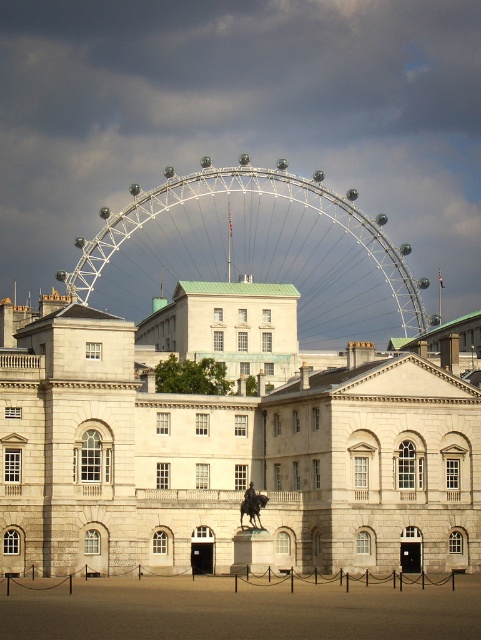
You are standing in front of the white stone palace at center and the white metallic ferris wheel at center. Which one has a narrower width?

The white stone palace at center is thinner than the white metallic ferris wheel at center, so the white stone palace at center has a narrower width.

You are standing at the center of the image. Which direction should you move to reach the white stone palace at center?

The white stone palace at center is already at the center of the image, so you don not need to move in any direction to reach it.